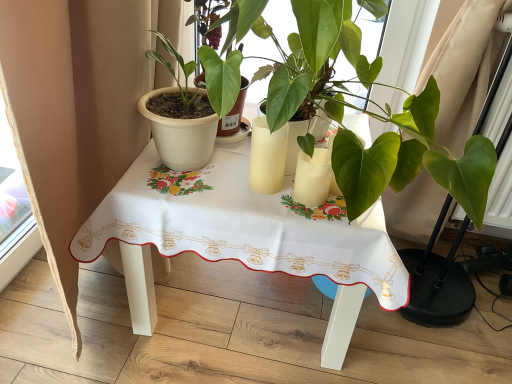
Question: Would you say green matte plant at center, which ranks as the 2th houseplant in left-to-right order, is to the left or to the right of matte white pot at left, the first houseplant viewed from the left, in the picture?

Choices:
 (A) left
 (B) right

Answer: (B)

Question: Is green matte plant at center, positioned as the 1th houseplant in right-to-left order, spatially inside matte white pot at left, which ranks as the second houseplant in right-to-left order, or outside of it?

Choices:
 (A) outside
 (B) inside

Answer: (A)

Question: Which object is the closest to the matte yellow glass at center, the second candle holder in the right-to-left sequence?

Choices:
 (A) white fabric table at center
 (B) matte white pot at left, which ranks as the second houseplant in right-to-left order
 (C) green matte plant at center, positioned as the 1th houseplant in right-to-left order
 (D) matte white candle at center, positioned as the 1th candle holder in right-to-left order

Answer: (D)

Question: Considering the real-world distances, which object is farthest from the white fabric table at center?

Choices:
 (A) matte white pot at left, the first houseplant viewed from the left
 (B) green matte plant at center, positioned as the 1th houseplant in right-to-left order
 (C) matte white candle at center, the second candle holder in the left-to-right sequence
 (D) matte yellow glass at center, placed as the 1th candle holder when sorted from left to right

Answer: (B)